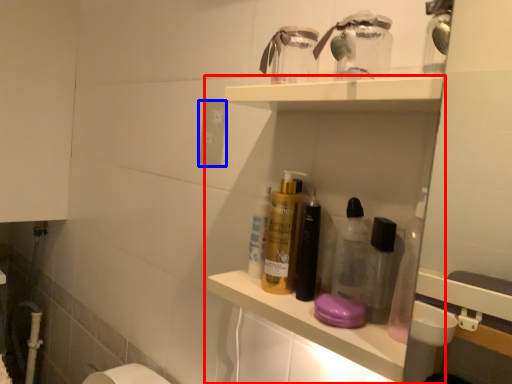
Question: Which object is closer to the camera taking this photo, shelf (highlighted by a red box) or electric outlet (highlighted by a blue box)?

Choices:
 (A) shelf
 (B) electric outlet

Answer: (A)